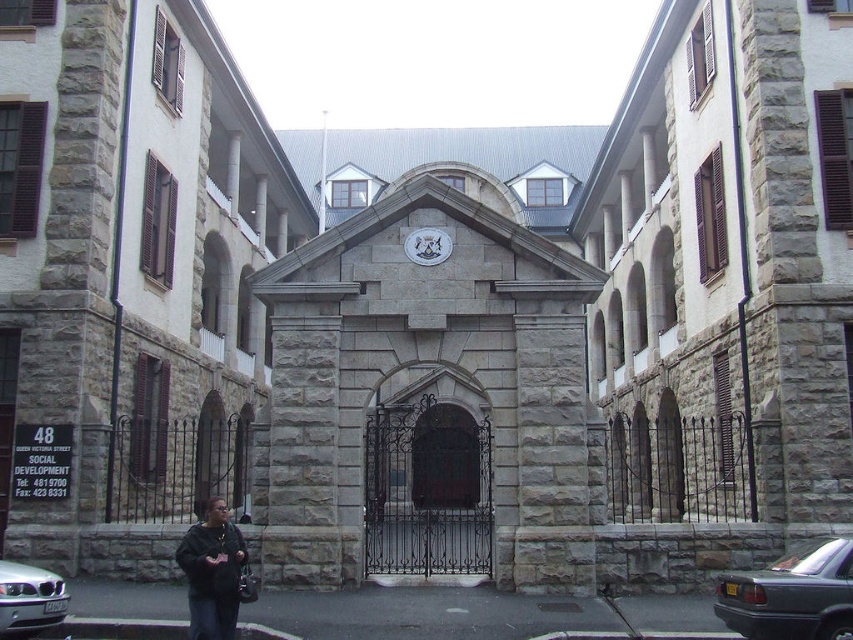
Which is more to the left, gray stone gate at center or white glossy clock at center?

Positioned to the left is gray stone gate at center.

Is gray stone gate at center wider than white glossy clock at center?

Yes.

You are a GUI agent. You are given a task and a screenshot of the screen. Output one action in this format:
    pyautogui.click(x=<x>, y=<y>)
    Task: Click on the gray stone gate at center
    The image size is (853, 640).
    Given the screenshot: What is the action you would take?
    pyautogui.click(x=428, y=384)

Is silver metallic car at lower left closer to camera compared to white glossy clock at center?

Yes, silver metallic car at lower left is in front of white glossy clock at center.

Who is higher up, silver metallic car at lower left or white glossy clock at center?

white glossy clock at center

Between point (33, 595) and point (433, 260), which one is positioned in front?

Point (33, 595)

You are a GUI agent. You are given a task and a screenshot of the screen. Output one action in this format:
    pyautogui.click(x=<x>, y=<y>)
    Task: Click on the silver metallic car at lower left
    This screenshot has height=640, width=853.
    Given the screenshot: What is the action you would take?
    28,600

Is dark gray metallic car at lower right above silver metallic car at lower left?

Yes.

Who is positioned more to the right, dark gray metallic car at lower right or silver metallic car at lower left?

dark gray metallic car at lower right

Image resolution: width=853 pixels, height=640 pixels. Describe the element at coordinates (791, 595) in the screenshot. I see `dark gray metallic car at lower right` at that location.

Image resolution: width=853 pixels, height=640 pixels. In order to click on dark gray metallic car at lower right in this screenshot , I will do `click(791, 595)`.